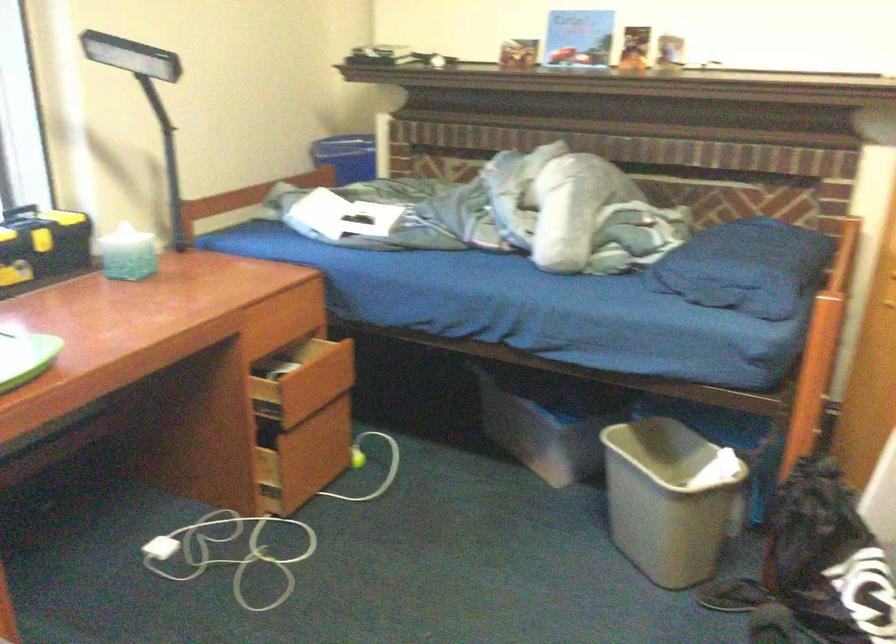
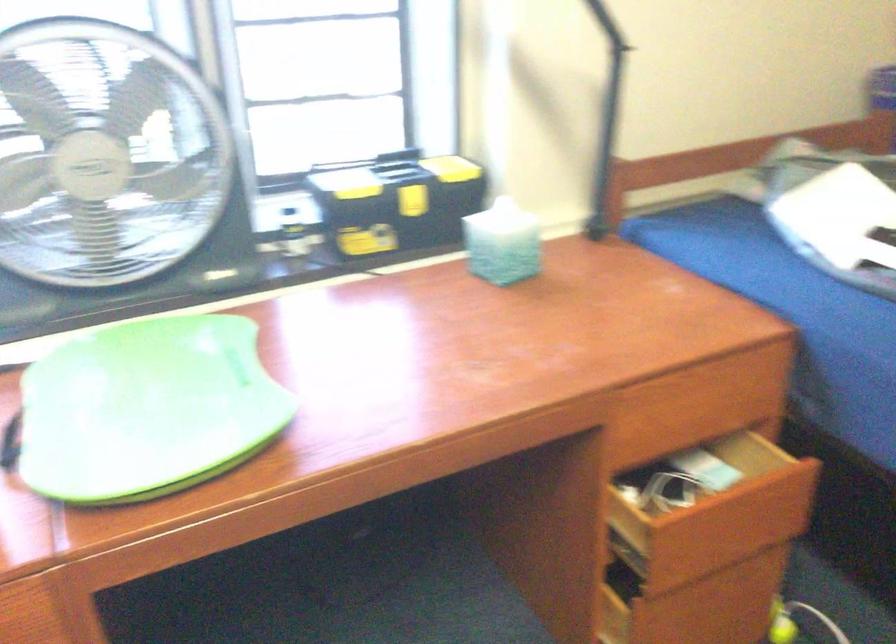
Find the pixel in the second image that matches pixel 278 327 in the first image.

(693, 415)